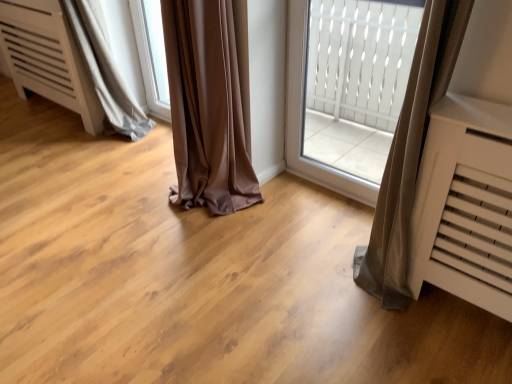
Question: Should I look upward or downward to see transparent glass window at center?

Choices:
 (A) up
 (B) down

Answer: (A)

Question: Is white textured glass at center bigger than transparent glass window at center?

Choices:
 (A) no
 (B) yes

Answer: (B)

Question: Can you confirm if white textured glass at center is positioned to the right of transparent glass window at center?

Choices:
 (A) no
 (B) yes

Answer: (B)

Question: Is transparent glass window at center a part of white textured glass at center?

Choices:
 (A) no
 (B) yes

Answer: (A)

Question: From the image's perspective, would you say white textured glass at center is shown under transparent glass window at center?

Choices:
 (A) no
 (B) yes

Answer: (B)

Question: Is the depth of white textured glass at center greater than that of transparent glass window at center?

Choices:
 (A) no
 (B) yes

Answer: (A)

Question: Can you confirm if white textured glass at center is shorter than transparent glass window at center?

Choices:
 (A) no
 (B) yes

Answer: (A)

Question: Considering the relative sizes of transparent glass window at center and white textured glass at center in the image provided, is transparent glass window at center taller than white textured glass at center?

Choices:
 (A) no
 (B) yes

Answer: (A)

Question: Does transparent glass window at center have a smaller size compared to white textured glass at center?

Choices:
 (A) no
 (B) yes

Answer: (B)

Question: Is transparent glass window at center aimed at white textured glass at center?

Choices:
 (A) yes
 (B) no

Answer: (B)

Question: Considering the relative sizes of transparent glass window at center and white textured glass at center in the image provided, is transparent glass window at center bigger than white textured glass at center?

Choices:
 (A) no
 (B) yes

Answer: (A)

Question: Is transparent glass window at center at the left side of white textured glass at center?

Choices:
 (A) yes
 (B) no

Answer: (A)

Question: Is transparent glass window at center thinner than white textured glass at center?

Choices:
 (A) yes
 (B) no

Answer: (A)

Question: Does white textured glass at center have a larger size compared to gray satin curtain at lower left?

Choices:
 (A) yes
 (B) no

Answer: (B)